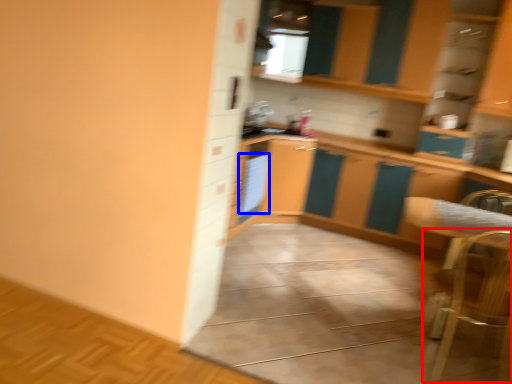
Question: Which object is closer to the camera taking this photo, armchair (highlighted by a red box) or appliance (highlighted by a blue box)?

Choices:
 (A) armchair
 (B) appliance

Answer: (A)